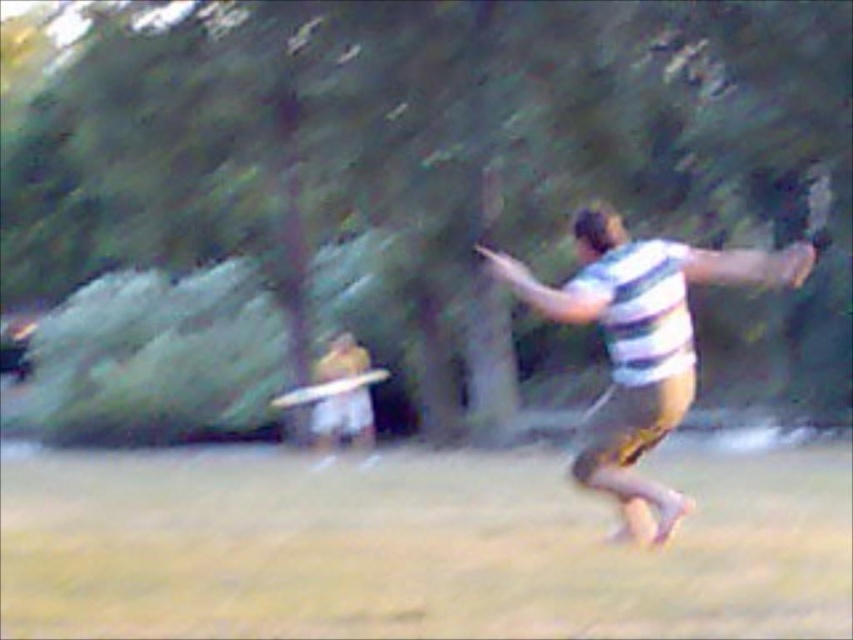
Question: Is white matte frisbee at center smaller than white plastic frisbee at center?

Choices:
 (A) no
 (B) yes

Answer: (A)

Question: Is white matte frisbee at center to the left of white plastic frisbee at center from the viewer's perspective?

Choices:
 (A) yes
 (B) no

Answer: (B)

Question: Which is nearer to the white plastic frisbee at center?

Choices:
 (A) green grass at lower center
 (B) white matte frisbee at center
 (C) green leafy tree at center
 (D) striped fabric shirt at center

Answer: (B)

Question: Among these points, which one is farthest from the camera?

Choices:
 (A) (335, 381)
 (B) (608, 344)
 (C) (91, 93)
 (D) (352, 355)

Answer: (D)

Question: Considering the real-world distances, which object is farthest from the white plastic frisbee at center?

Choices:
 (A) green grass at lower center
 (B) striped fabric shirt at center
 (C) white matte frisbee at center
 (D) green leafy tree at center

Answer: (A)

Question: Is green grass at lower center to the left of striped fabric shirt at center from the viewer's perspective?

Choices:
 (A) no
 (B) yes

Answer: (B)